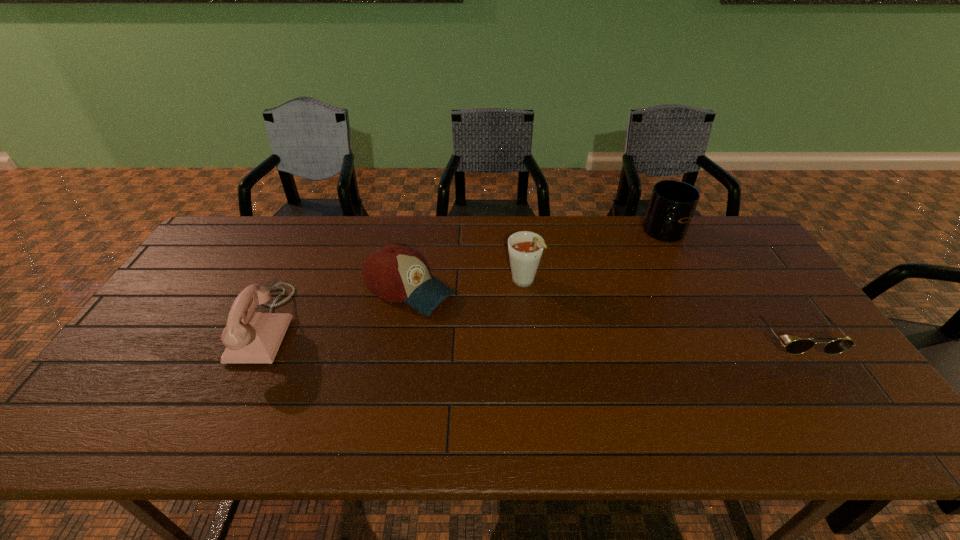
What are the coordinates of `free space that is in between the leftmost object and the rightmost object` in the screenshot? It's located at (529, 332).

This screenshot has height=540, width=960. I want to click on empty location between the fourth tallest object and the telephone, so tap(338, 307).

Identify the location of free space between the root beer and the telephone. (395, 304).

You are a GUI agent. You are given a task and a screenshot of the screen. Output one action in this format:
    pyautogui.click(x=<x>, y=<y>)
    Task: Click on the free area in between the baseball cap and the rightmost object
    
    Given the screenshot: What is the action you would take?
    pyautogui.click(x=600, y=313)

Find the location of a particular element. This screenshot has height=540, width=960. blank region between the telephone and the fourth object from left to right is located at coordinates (466, 280).

Where is `blank region between the telephone and the fourth object from left to right`? This screenshot has height=540, width=960. blank region between the telephone and the fourth object from left to right is located at coordinates (466, 280).

Where is `free space between the leftmost object and the mug`? The width and height of the screenshot is (960, 540). free space between the leftmost object and the mug is located at coordinates (466, 280).

Find the location of a particular element. object that is the second closest one to the rightmost object is located at coordinates (525, 248).

I want to click on object that is the fourth closest to the third object from right to left, so click(250, 337).